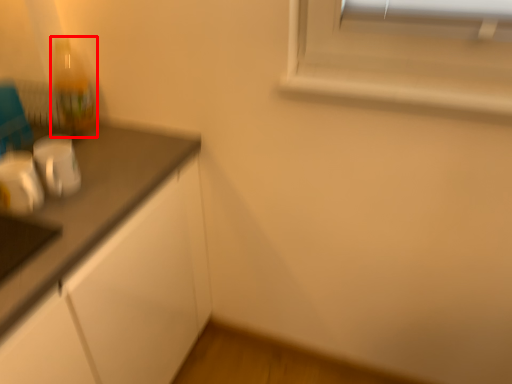
Question: From the image's perspective, where is bottle (annotated by the red box) located relative to appliance?

Choices:
 (A) above
 (B) below

Answer: (A)